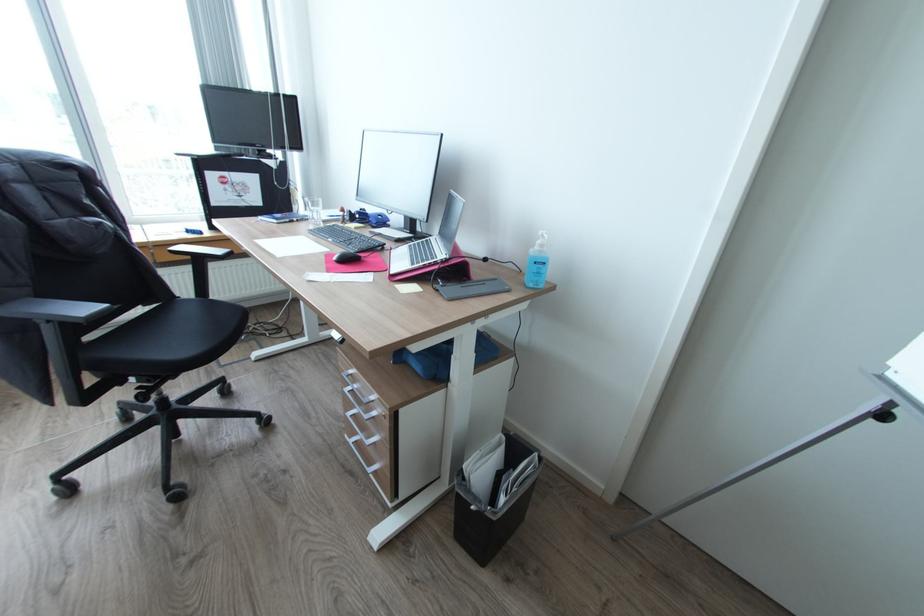
The image size is (924, 616). I want to click on red notebook, so click(357, 264).